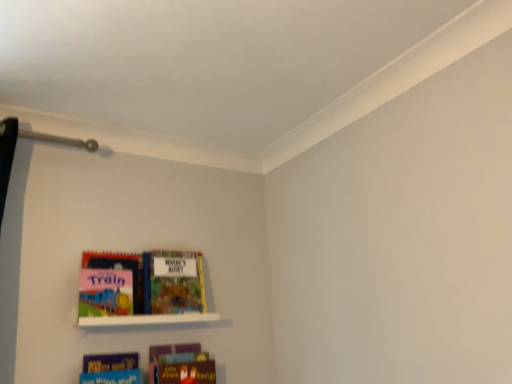
Question: Is point (82, 288) closer or farther from the camera than point (175, 274)?

Choices:
 (A) closer
 (B) farther

Answer: (A)

Question: Choose the correct answer: Is matte board book at left, which ranks as the fourth book in bottom-to-top order, inside multicolored cardboard book at center, which appears as the third book when ordered from the bottom, or outside it?

Choices:
 (A) inside
 (B) outside

Answer: (B)

Question: Which is nearer to the blue matte book at lower center, placed as the third book when sorted from top to bottom?

Choices:
 (A) multicolored cardboard book at center, which appears as the third book when ordered from the bottom
 (B) matte cardboard book at lower center, placed as the fourth book when sorted from top to bottom
 (C) white matte shelf at lower left
 (D) matte board book at left, the 1th book viewed from the top

Answer: (B)

Question: Estimate the real-world distances between objects in this image. Which object is closer to the matte cardboard book at lower center, placed as the fourth book when sorted from top to bottom?

Choices:
 (A) white matte shelf at lower left
 (B) multicolored cardboard book at center, which appears as the third book when ordered from the bottom
 (C) blue matte book at lower center, which is the 2th book from bottom to top
 (D) matte board book at left, which ranks as the fourth book in bottom-to-top order

Answer: (C)